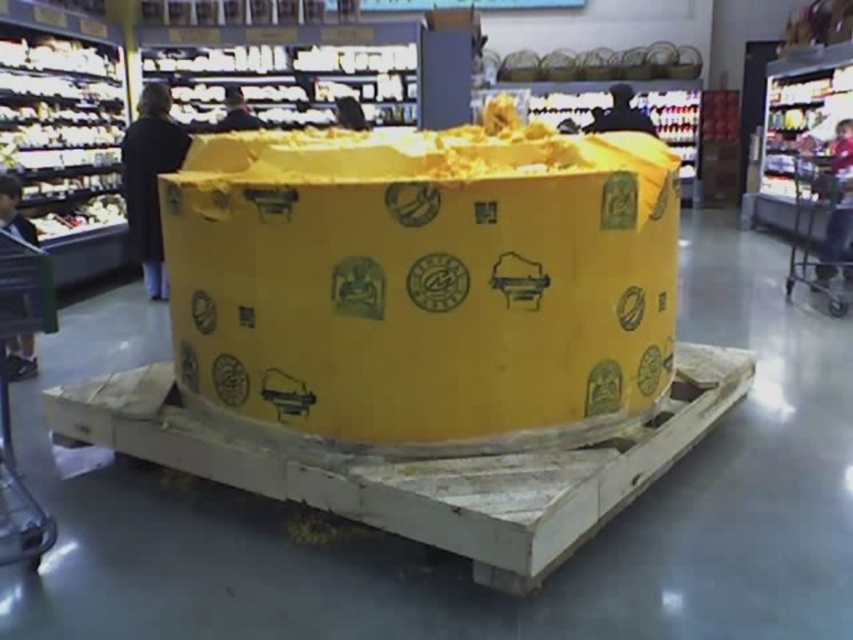
You are standing in the grocery store and want to determine which of the two points, point (1, 397) or point (844, 296), is closer to you. Based on the scene description, which point is nearer?

Point (1, 397) is closer to the viewer than point (844, 296).

You are a customer in the grocery store holding the metallic silver shopping cart at lower left. You want to pick up the yellow cardboard box at center to put it in your cart. Can you reach the box without moving the cart?

The yellow cardboard box at center is 4.26 feet away from the metallic silver shopping cart at lower left. Since the average shopping cart has a reach distance of about 3 feet, you cannot reach the box without moving the cart.

You are a customer in the grocery store and want to grab a metallic silver shopping cart. There are two metallic silver shopping carts available. Which one is closer to you, the metallic silver shopping cart at lower left or the metallic silver shopping cart at right?

The metallic silver shopping cart at lower left is closer to you because it is positioned below the metallic silver shopping cart at right, which is further away.